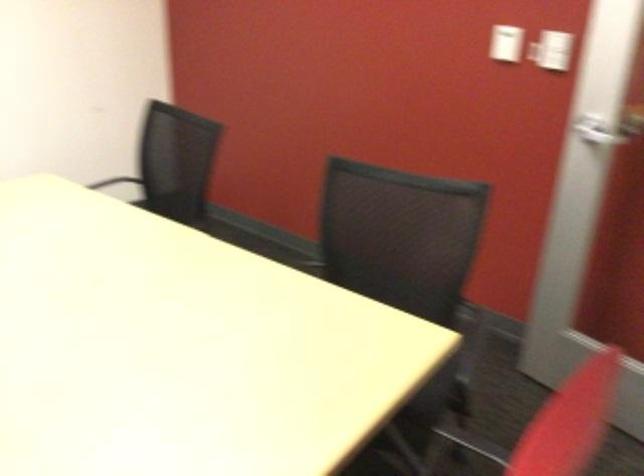
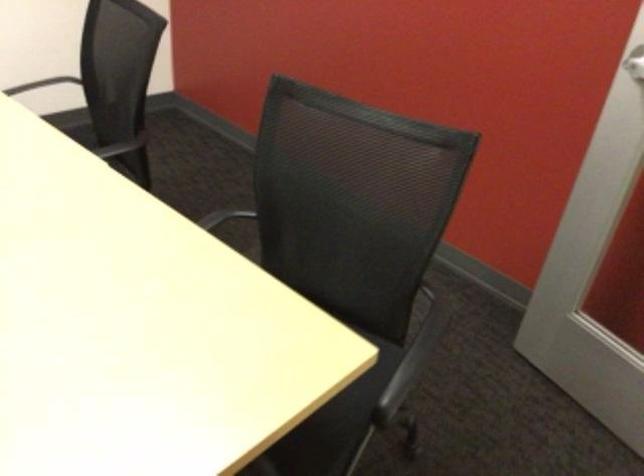
The point at [290,266] is marked in the first image. Where is the corresponding point in the second image?

(223, 217)